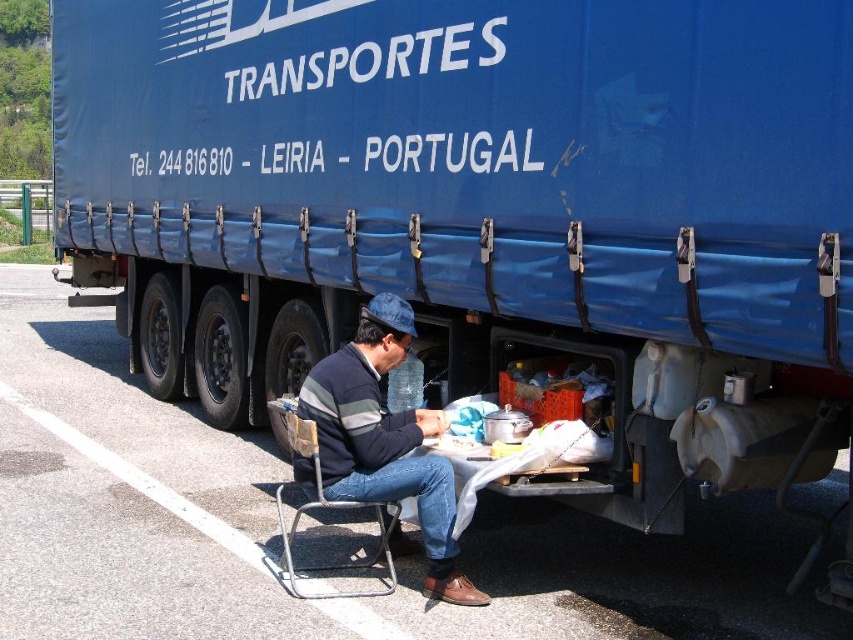
Does asphalt road at lower left have a greater height compared to metallic gray folding chair at lower center?

Yes.

Who is positioned more to the right, asphalt road at lower left or metallic gray folding chair at lower center?

Positioned to the right is metallic gray folding chair at lower center.

Identify the location of asphalt road at lower left. The height and width of the screenshot is (640, 853). (277, 531).

In the scene shown: Who is more distant from viewer, (311, 378) or (305, 438)?

The point (311, 378) is more distant.

How distant is dark blue denim jeans at lower center from metallic gray folding chair at lower center?

dark blue denim jeans at lower center and metallic gray folding chair at lower center are 34.25 centimeters apart from each other.

Does point (302, 417) lie in front of point (288, 556)?

Yes.

Where is `dark blue denim jeans at lower center`? dark blue denim jeans at lower center is located at coordinates (384, 440).

Who is higher up, asphalt road at lower left or dark blue denim jeans at lower center?

Positioned higher is asphalt road at lower left.

Who is more distant from viewer, (250, 566) or (397, 301)?

Positioned behind is point (250, 566).

Identify the location of asphalt road at lower left. The height and width of the screenshot is (640, 853). (277, 531).

Image resolution: width=853 pixels, height=640 pixels. I want to click on asphalt road at lower left, so click(277, 531).